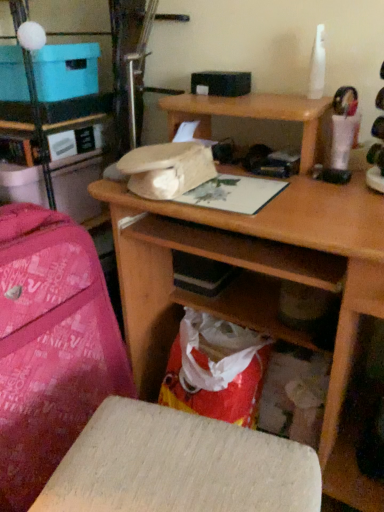
Question: From a real-world perspective, is blue cardboard box at upper left positioned above or below wooden stool at lower center?

Choices:
 (A) above
 (B) below

Answer: (A)

Question: From their relative heights in the image, would you say blue cardboard box at upper left is taller or shorter than wooden stool at lower center?

Choices:
 (A) short
 (B) tall

Answer: (A)

Question: Which object is positioned closest to the pink fabric bag at left?

Choices:
 (A) wooden desk at center
 (B) blue cardboard box at upper left
 (C) pink fabric suitcase at left
 (D) wooden stool at lower center

Answer: (B)

Question: Estimate the real-world distances between objects in this image. Which object is closer to the blue cardboard box at upper left?

Choices:
 (A) wooden stool at lower center
 (B) wooden desk at center
 (C) pink fabric bag at left
 (D) pink fabric suitcase at left

Answer: (C)